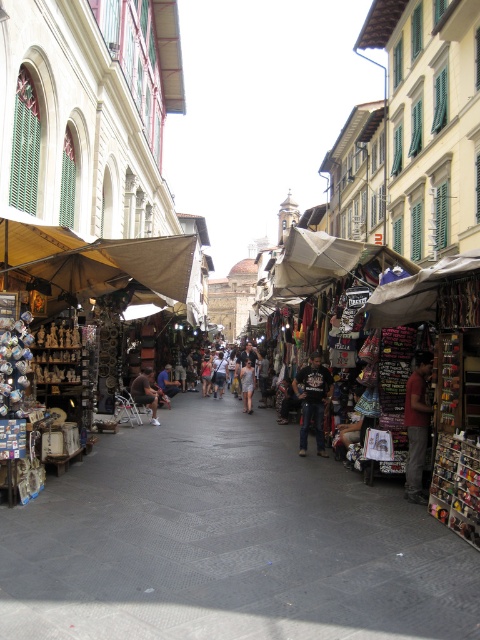
Does red cotton t-shirt at center appear on the right side of light gray fabric dress at center?

Indeed, red cotton t-shirt at center is positioned on the right side of light gray fabric dress at center.

What do you see at coordinates (417, 426) in the screenshot?
I see `red cotton t-shirt at center` at bounding box center [417, 426].

Does point (418, 369) come behind point (240, 372)?

No, it is not.

Where is `red cotton t-shirt at center`? This screenshot has width=480, height=640. red cotton t-shirt at center is located at coordinates (417, 426).

Between smooth gray pavement at center and light gray fabric dress at center, which one appears on the left side from the viewer's perspective?

smooth gray pavement at center

Is point (92, 611) farther from camera compared to point (250, 385)?

No, it is in front of (250, 385).

Locate an element on the screen. The width and height of the screenshot is (480, 640). smooth gray pavement at center is located at coordinates (228, 544).

Is point (423, 449) farther from viewer compared to point (170, 390)?

No, it is not.

Does red cotton t-shirt at center have a greater width compared to dark brown leather jacket at center?

Yes, red cotton t-shirt at center is wider than dark brown leather jacket at center.

Is point (419, 397) positioned after point (163, 369)?

That is False.

Image resolution: width=480 pixels, height=640 pixels. In order to click on red cotton t-shirt at center in this screenshot , I will do `click(417, 426)`.